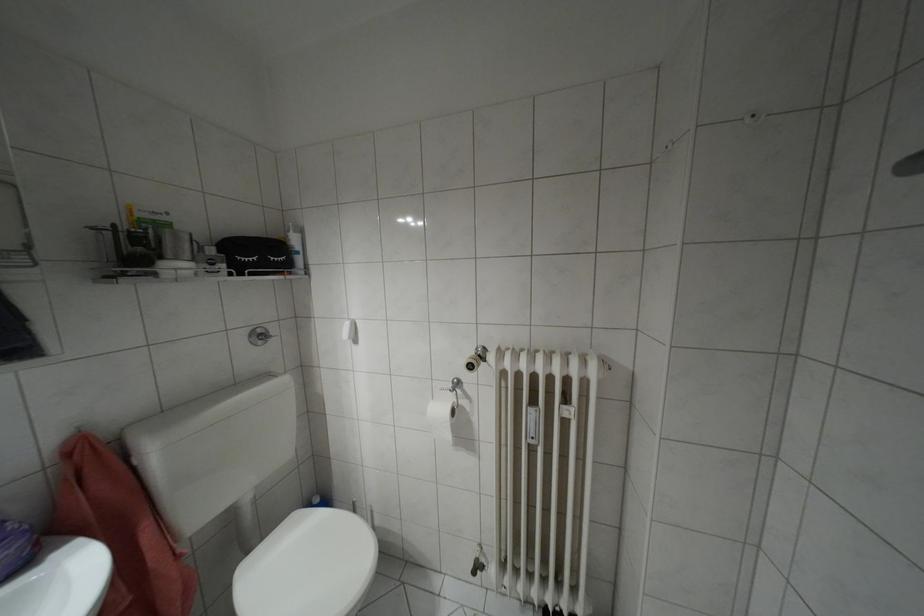
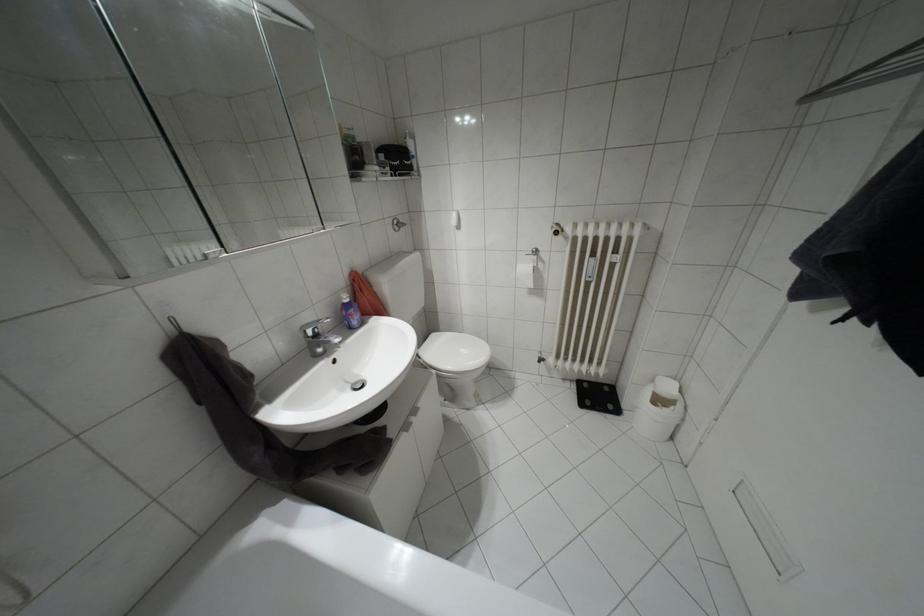
Which direction would the cameraman need to move to produce the second image?

The cameraman walked toward left, backward.